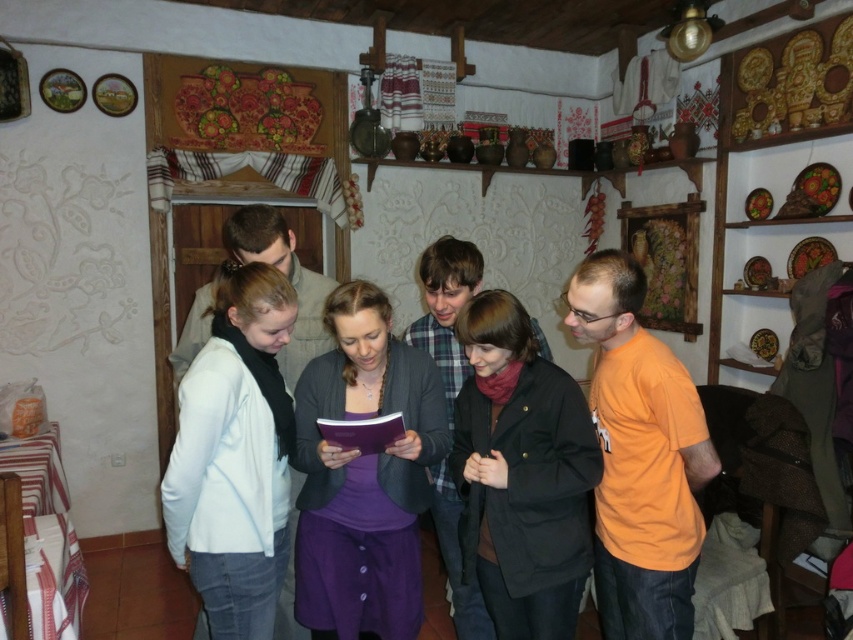
You are an interior designer observing the group in the scene. You need to determine which of the two jackets, the light blue fabric jacket at left or the purple matte sweater at center, requires a smaller storage space for hanging. Which one would you choose?

The light blue fabric jacket at left has a smaller width than the purple matte sweater at center, so it requires less storage space for hanging.

You are organizing a clothing donation drive and need to categorize items by size. You have two garments in front of you, the light blue fabric jacket at left and the purple matte sweater at center. Based on their sizes, which one should be placed in the small section?

The light blue fabric jacket at left is smaller than the purple matte sweater at center, so it should be placed in the small section.